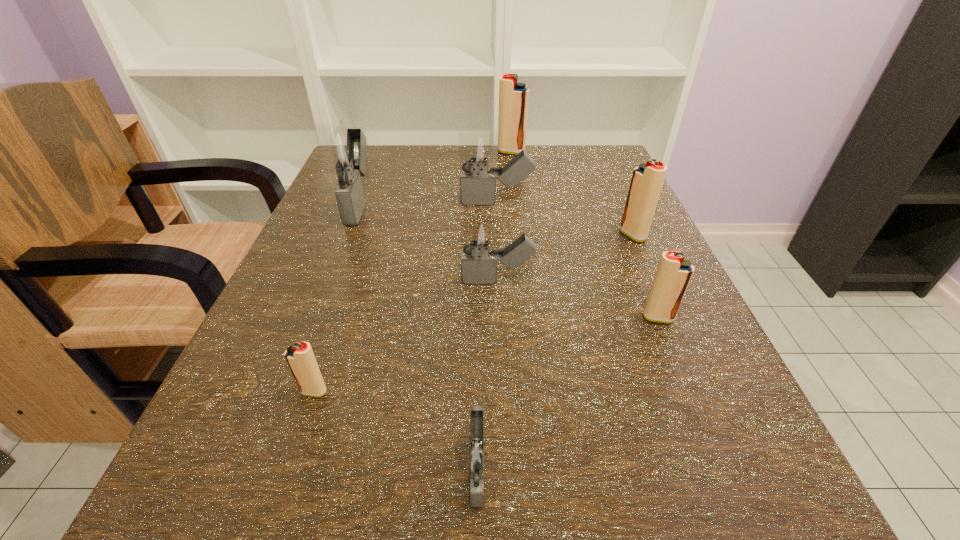
Identify the location of vacant space that's between the leftmost gray igniter and the second smallest gray igniter. (429, 242).

Find the location of a particular element. The width and height of the screenshot is (960, 540). free space between the leftmost gray igniter and the second farthest red igniter is located at coordinates (496, 219).

The height and width of the screenshot is (540, 960). I want to click on empty location between the farthest red igniter and the second farthest red igniter, so click(572, 194).

Locate an element on the screen. vacant area that lies between the second nearest igniter and the leftmost gray igniter is located at coordinates (337, 298).

This screenshot has width=960, height=540. What are the coordinates of `unoccupied position between the third smallest gray igniter and the seventh farthest object` in the screenshot? It's located at (405, 297).

Find the location of `vacant area that lies between the nearest object and the leftmost gray igniter`. vacant area that lies between the nearest object and the leftmost gray igniter is located at coordinates (419, 335).

This screenshot has height=540, width=960. In order to click on vacant space that's between the leftmost red igniter and the third smallest gray igniter in this screenshot , I will do `click(405, 297)`.

Locate an element on the screen. The image size is (960, 540). free space between the leftmost gray igniter and the nearest object is located at coordinates (419, 335).

At what (x,y) coordinates should I click in order to perform the action: click on empty space between the second biggest red igniter and the third smallest gray igniter. Please return your answer as a coordinate pair (x, y). Looking at the image, I should click on (564, 219).

This screenshot has width=960, height=540. In order to click on the sixth closest object to the seventh farthest object in this screenshot , I will do `click(647, 180)`.